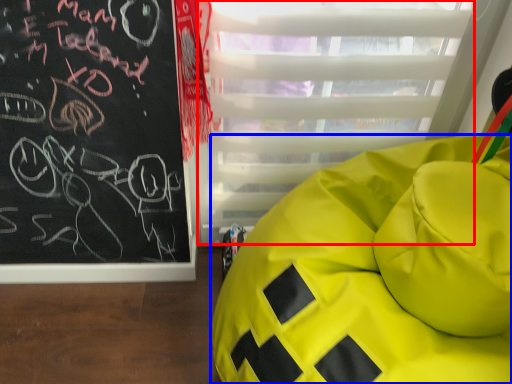
Question: Which point is further to the camera, glass door (highlighted by a red box) or furniture (highlighted by a blue box)?

Choices:
 (A) glass door
 (B) furniture

Answer: (A)